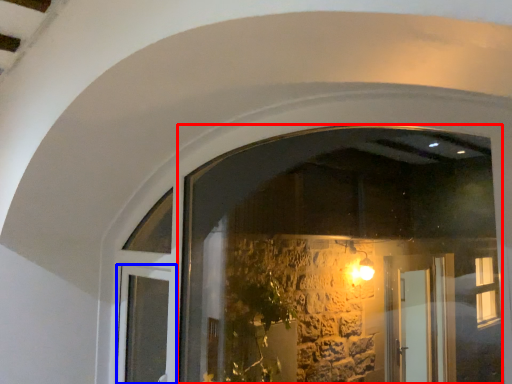
Question: Which object is further to the camera taking this photo, window (highlighted by a red box) or door (highlighted by a blue box)?

Choices:
 (A) window
 (B) door

Answer: (B)